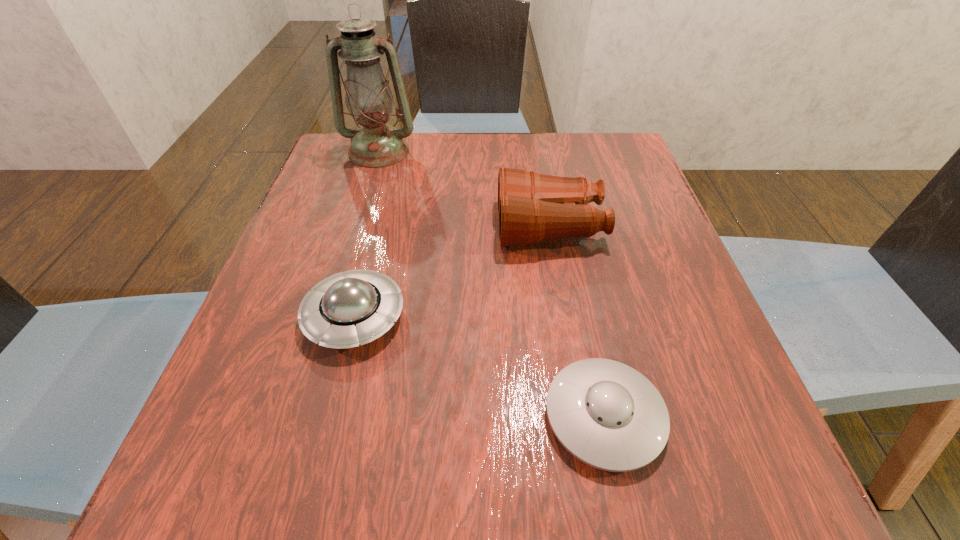
At what (x,y) coordinates should I click in order to perform the action: click on free space between the third nearest object and the farthest object. Please return your answer as a coordinate pair (x, y). Looking at the image, I should click on (465, 189).

Locate an element on the screen. free spot between the taller saucer and the third shortest object is located at coordinates (452, 272).

The height and width of the screenshot is (540, 960). I want to click on free space that is in between the farthest object and the third nearest object, so click(x=465, y=189).

Locate an element on the screen. The width and height of the screenshot is (960, 540). free space that is in between the nearest object and the farthest object is located at coordinates (492, 284).

Image resolution: width=960 pixels, height=540 pixels. What are the coordinates of `free space between the oil lamp and the third nearest object` in the screenshot? It's located at (465, 189).

This screenshot has width=960, height=540. I want to click on unoccupied area between the farther saucer and the third shortest object, so tap(452, 272).

The width and height of the screenshot is (960, 540). I want to click on unoccupied area between the second tallest object and the oil lamp, so click(x=465, y=189).

This screenshot has height=540, width=960. I want to click on object that stands as the second closest to the second nearest object, so click(x=605, y=413).

Select which object appears as the third closest to the nearer saucer. Please provide its 2D coordinates. Your answer should be formatted as a tuple, i.e. [(x, y)], where the tuple contains the x and y coordinates of a point satisfying the conditions above.

[(369, 100)]

At what (x,y) coordinates should I click in order to perform the action: click on blank space that satisfies the following two spatial constraints: 1. through the lenses of the third shortest object; 2. on the left side of the nearer saucer. Please return your answer as a coordinate pair (x, y). The image size is (960, 540). Looking at the image, I should click on [583, 416].